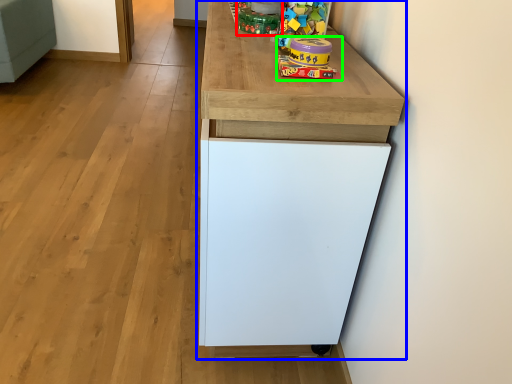
Question: Which is farther away from toy (highlighted by a red box)? cabinetry (highlighted by a blue box) or toy (highlighted by a green box)?

Choices:
 (A) cabinetry
 (B) toy

Answer: (A)